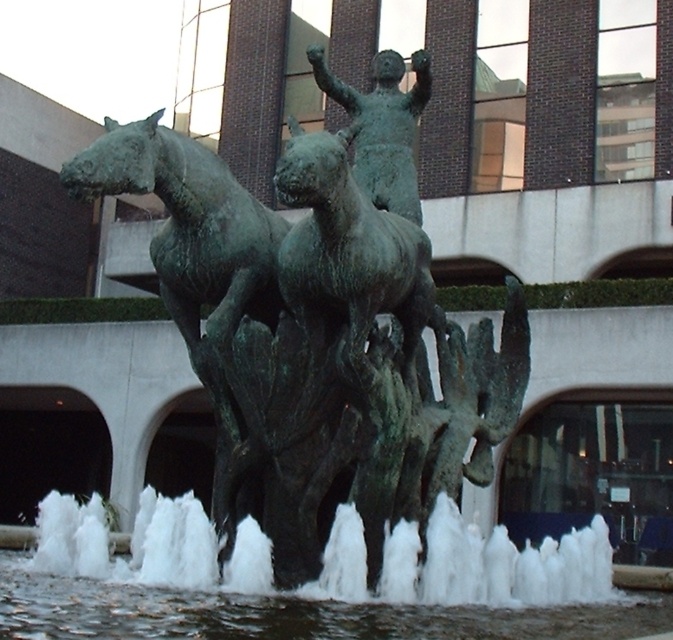
Question: Can you confirm if green patina horse at left is positioned below white frothy water at center?

Choices:
 (A) yes
 (B) no

Answer: (B)

Question: Considering the relative positions of green patina bronze statue at center and green patina horse at left in the image provided, where is green patina bronze statue at center located with respect to green patina horse at left?

Choices:
 (A) below
 (B) above

Answer: (B)

Question: Among these points, which one is nearest to the camera?

Choices:
 (A) pos(425,451)
 (B) pos(104,588)
 (C) pos(217,269)

Answer: (B)

Question: Which object is positioned farthest from the green patina bronze statue at center?

Choices:
 (A) green patina horse at left
 (B) white frothy water at center

Answer: (B)

Question: Does green patina horse at left have a larger size compared to white frothy water at center?

Choices:
 (A) no
 (B) yes

Answer: (A)

Question: Which point is farther to the camera?

Choices:
 (A) green patina horse at left
 (B) green patina bronze statue at center
 (C) white frothy water at center

Answer: (A)